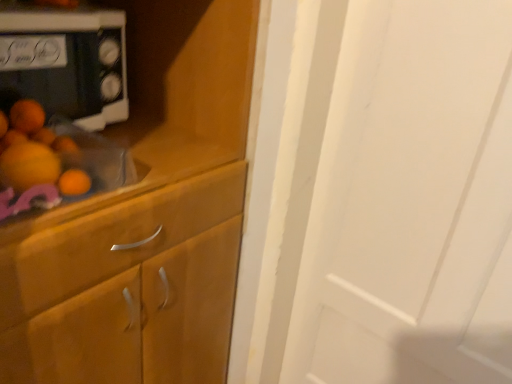
Identify the location of free space above white glossy microwave at upper left (from a real-world perspective). The height and width of the screenshot is (384, 512). (44, 9).